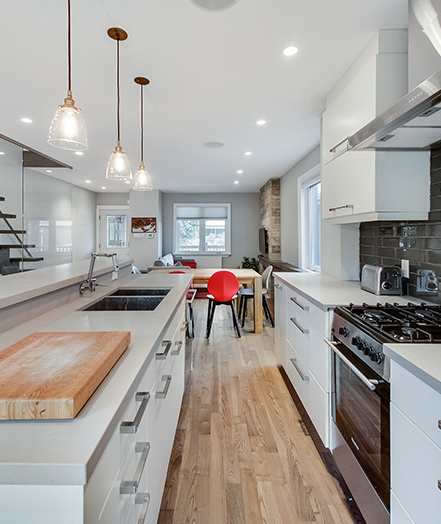
This screenshot has width=441, height=524. I want to click on chair legs, so click(268, 309), click(267, 319), click(244, 320), click(238, 308), click(238, 328), click(233, 325), click(208, 327), click(213, 312).